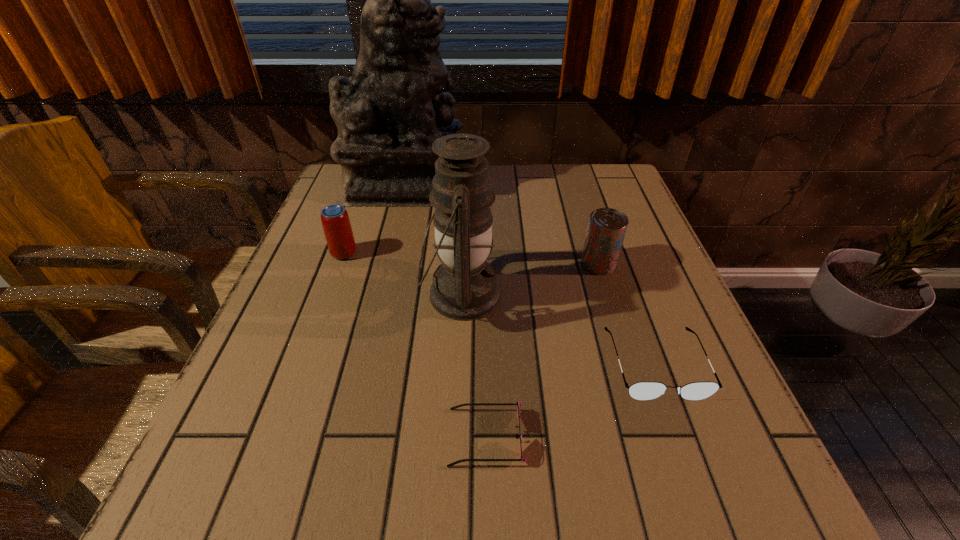
Find the location of a particular element. sculpture is located at coordinates (395, 106).

Find the location of a particular element. Image resolution: width=960 pixels, height=540 pixels. the farthest object is located at coordinates (395, 106).

Where is `the fifth shortest object`? This screenshot has width=960, height=540. the fifth shortest object is located at coordinates (465, 287).

This screenshot has height=540, width=960. Find the location of `the right beer can`. the right beer can is located at coordinates (606, 230).

Find the location of a particular element. the left beer can is located at coordinates (336, 224).

Find the location of a particular element. the second shortest object is located at coordinates (643, 391).

Find the location of a particular element. This screenshot has height=540, width=960. the shortest object is located at coordinates (518, 404).

Where is `sunglasses`? The height and width of the screenshot is (540, 960). sunglasses is located at coordinates (518, 404).

Locate an element on the screen. The height and width of the screenshot is (540, 960). vacant space located 0.330m on the front-facing side of the tallest object is located at coordinates (584, 185).

Locate an element on the screen. free space located on the front of the oil lamp is located at coordinates (455, 422).